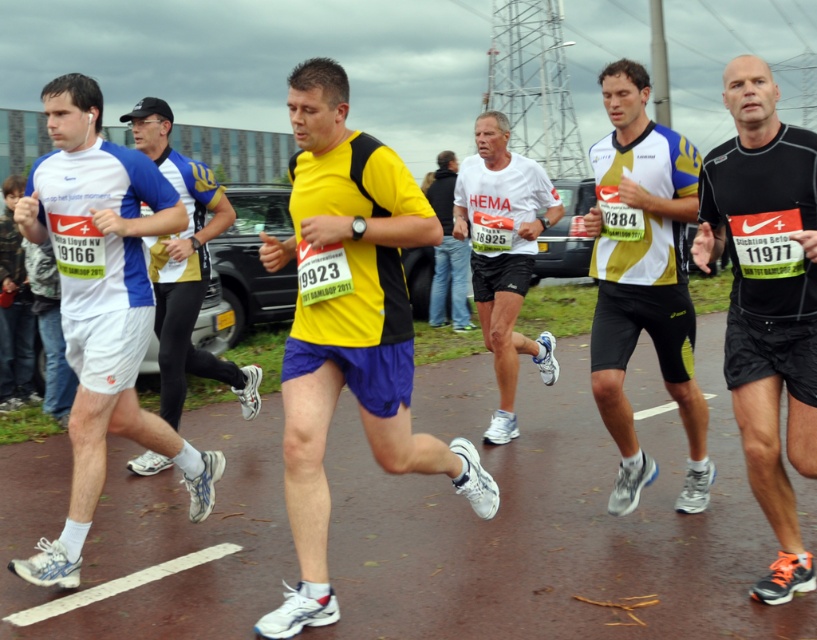
You are a photographer at the marathon event. You want to take a photo that includes both the yellow and white jersey at center and the white matte shirt at center. Which one should you focus on to ensure the taller object is in the frame first?

The yellow and white jersey at center is taller than the white matte shirt at center, so you should focus on the yellow and white jersey at center first to ensure it is in the frame.